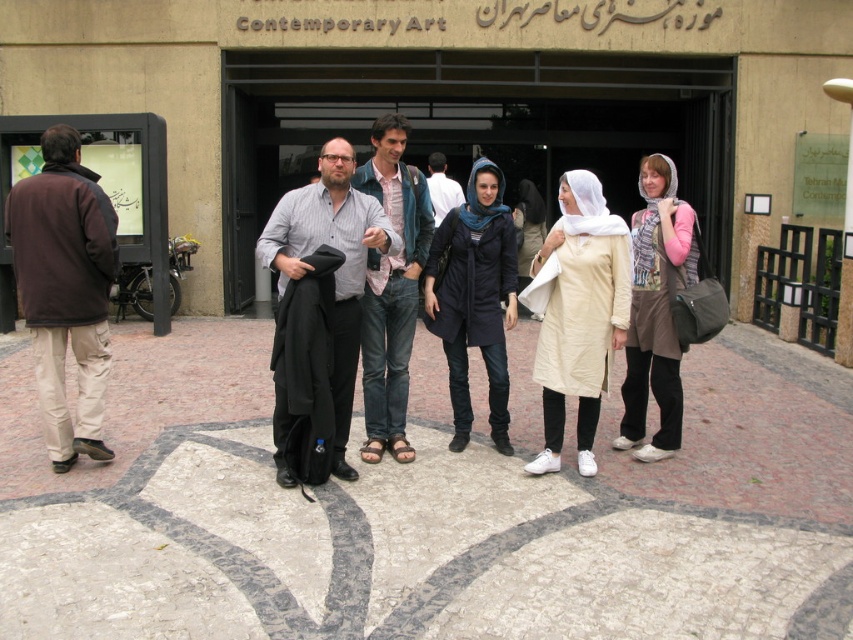
You are a photographer trying to capture a detailed shot of the brown fleece jacket at left and the denim jeans at center. Which object should you focus on first to ensure clarity in your photo?

The brown fleece jacket at left is closer to the viewer than the denim jeans at center, so you should focus on the brown fleece jacket at left first to ensure clarity.

You are a photographer standing at the center of the paved area with the geometric pattern. You want to take a photo of the group, but you need to ensure the brown fleece jacket at left is visible in the frame. Based on its position, can you confirm if it will be in the shot?

The brown fleece jacket at left is located at point (65, 289), which is within the camera frame, so yes, it will be visible in the photo.

You are standing at point (438, 196) and want to walk to point (531, 252). Is there any obstruction between these two points based on the scene?

Point (531, 252) is behind point (438, 196), so there might be an obstruction between them.